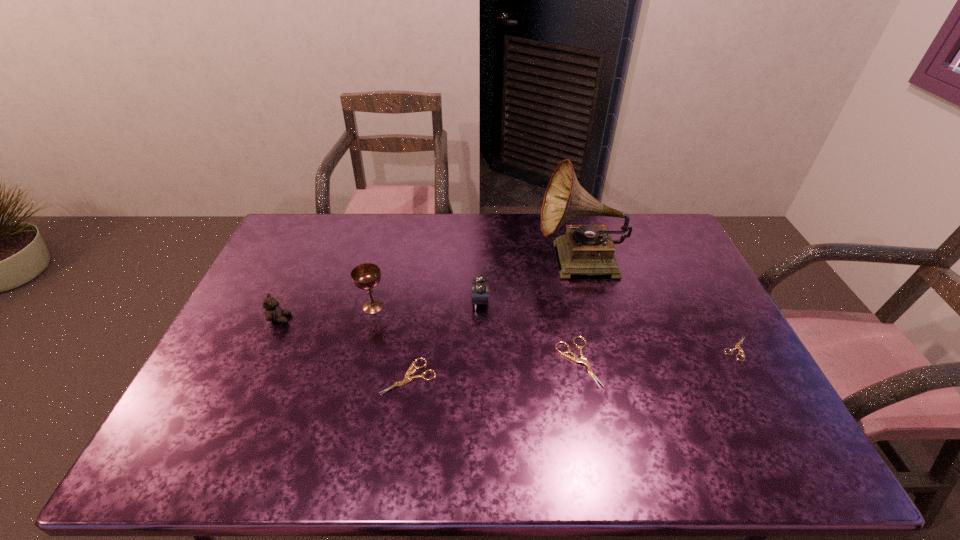
The width and height of the screenshot is (960, 540). In order to click on chalice in this screenshot , I will do `click(366, 276)`.

The image size is (960, 540). Identify the location of vacant space situated 0.050m on the back of the third object from left to right. (414, 345).

Identify the location of blank space located on the left of the second shears from right to left. (432, 362).

The image size is (960, 540). Identify the location of free spot located on the left of the shortest shears. pos(589,348).

The height and width of the screenshot is (540, 960). I want to click on vacant space situated 0.090m from the horn of the record player, so coord(511,262).

This screenshot has width=960, height=540. I want to click on free spot located from the horn of the record player, so click(511, 262).

Find the location of a particular element. The image size is (960, 540). vacant region located 0.250m from the horn of the record player is located at coordinates (464, 262).

This screenshot has width=960, height=540. Find the location of `free region located 0.070m on the face of the leftmost object`. free region located 0.070m on the face of the leftmost object is located at coordinates (314, 319).

Locate an element on the screen. The height and width of the screenshot is (540, 960). vacant space located 0.390m on the front side of the fourth object from left to right is located at coordinates (347, 302).

Identify the location of vacant area located 0.200m on the front side of the fourth object from left to right. (407, 302).